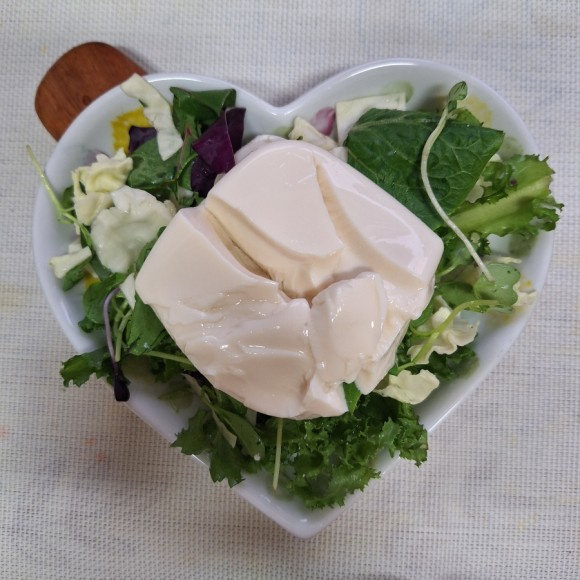
Identify the location of white china heart shaped serving dish. (275, 112).